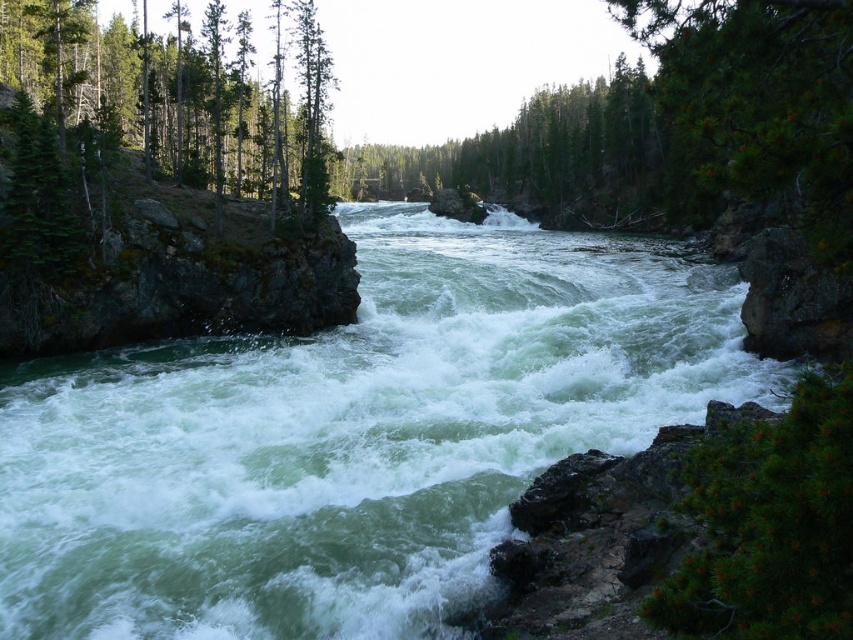
Which is in front, point (474, 314) or point (325, 212)?

Point (474, 314) is more forward.

Is green smooth water at center shorter than green matte tree at left?

Indeed, green smooth water at center has a lesser height compared to green matte tree at left.

The image size is (853, 640). What are the coordinates of `green smooth water at center` in the screenshot? It's located at (x=351, y=435).